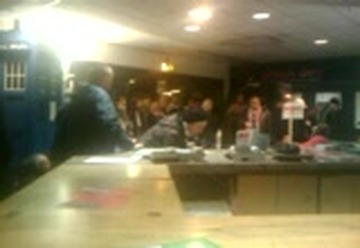
Find the location of a particular element. The image size is (360, 248). doorway is located at coordinates (194, 81).